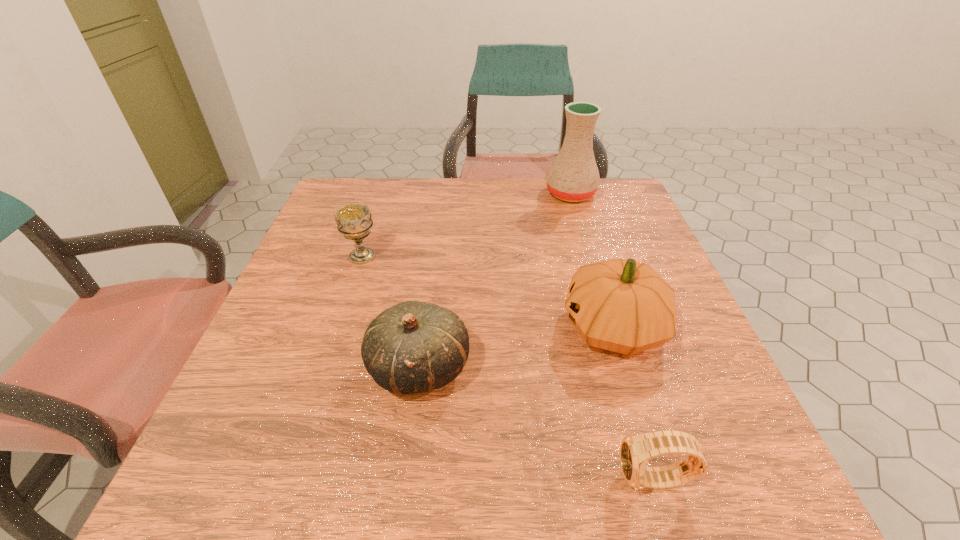
Where is `object identified as the second closest to the shorter gourd`? object identified as the second closest to the shorter gourd is located at coordinates (354, 221).